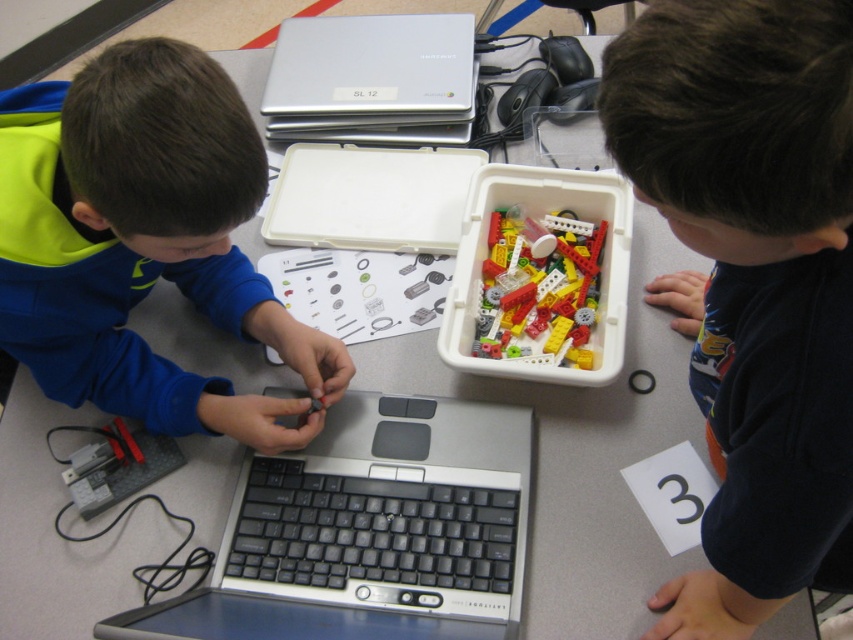
From the picture: Where is the blue matte shirt at left located in the image?

The blue matte shirt at left is located at point 0.378 in the x coordinate and 0.169 in the y coordinate.

You are a teacher observing the classroom scene. You notice the dark blue fabric at lower right and the silver metallic laptop at upper center. Which object takes up more space in the image?

The dark blue fabric at lower right has a larger size compared to the silver metallic laptop at upper center, so it takes up more space in the image.

You are a teacher observing the classroom. You notice the dark blue fabric at lower right and the silver metallic laptop at upper center. Which object is positioned lower in the image?

The dark blue fabric at lower right is positioned lower in the image than the silver metallic laptop at upper center.